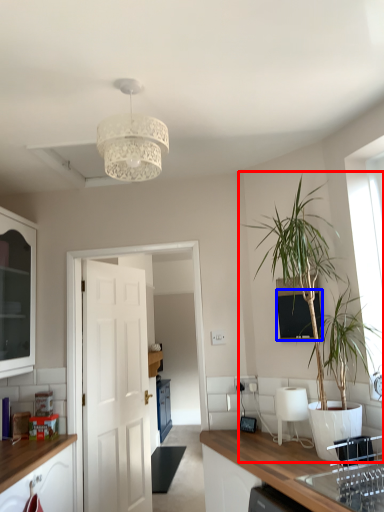
Question: Which object is further to the camera taking this photo, houseplant (highlighted by a red box) or window screen (highlighted by a blue box)?

Choices:
 (A) houseplant
 (B) window screen

Answer: (B)